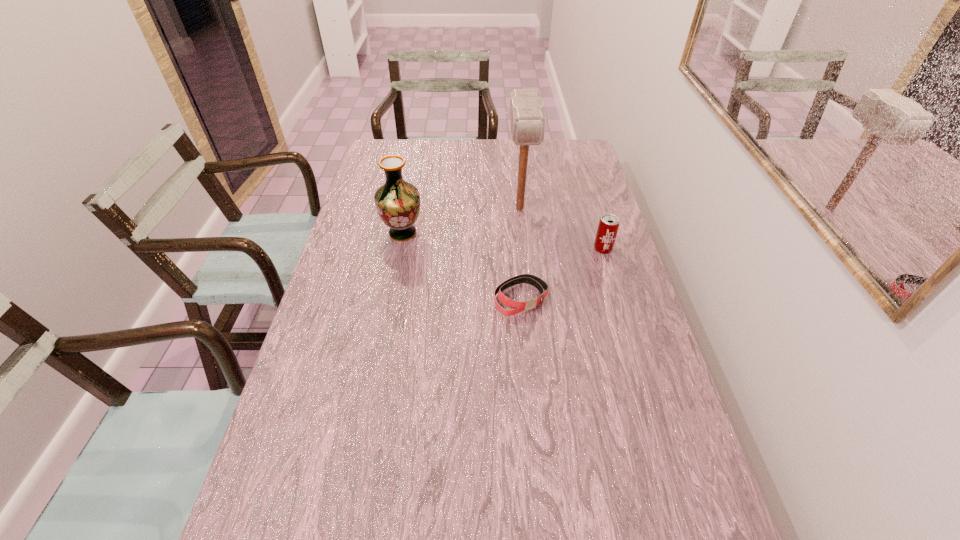
Find the location of `free space located 0.120m on the left of the shortest object`. free space located 0.120m on the left of the shortest object is located at coordinates (452, 298).

Where is `object that is positioned at the left edge`? Image resolution: width=960 pixels, height=540 pixels. object that is positioned at the left edge is located at coordinates (397, 202).

The width and height of the screenshot is (960, 540). In order to click on object located in the right edge section of the desktop in this screenshot , I will do `click(608, 226)`.

This screenshot has width=960, height=540. In order to click on free space at the far edge of the desktop in this screenshot , I will do `click(429, 156)`.

Where is `vacant region at the left edge of the desktop`? The image size is (960, 540). vacant region at the left edge of the desktop is located at coordinates (343, 278).

In order to click on vacant space at the right edge in this screenshot , I will do `click(582, 212)`.

Where is `free space between the vase and the rightmost object`? The image size is (960, 540). free space between the vase and the rightmost object is located at coordinates (503, 241).

Locate an element on the screen. The height and width of the screenshot is (540, 960). vacant area that lies between the rightmost object and the third shortest object is located at coordinates (503, 241).

Identify the location of free space between the mallet and the shortest object. The width and height of the screenshot is (960, 540). (520, 253).

This screenshot has height=540, width=960. Find the location of `vacant area between the third tallest object and the dog collar`. vacant area between the third tallest object and the dog collar is located at coordinates (562, 273).